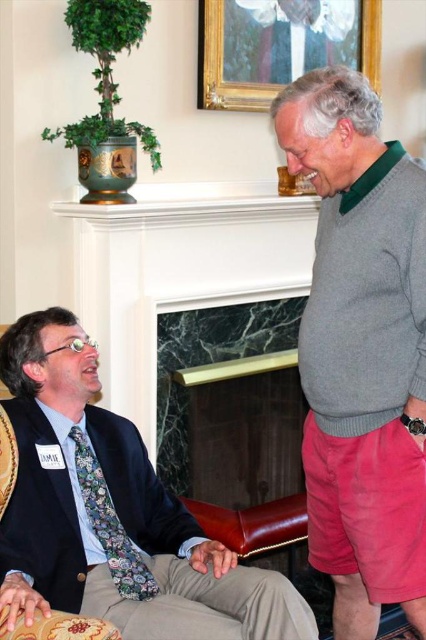
Between knit gray sweater at right and floral tie at left, which one appears on the left side from the viewer's perspective?

floral tie at left

Is knit gray sweater at right further to the viewer compared to floral tie at left?

Yes, knit gray sweater at right is behind floral tie at left.

Is point (419, 296) closer to viewer compared to point (242, 586)?

Yes, point (419, 296) is closer to viewer.

At what (x,y) coordinates should I click in order to perform the action: click on knit gray sweater at right. Please return your answer as a coordinate pair (x, y). This screenshot has height=640, width=426. Looking at the image, I should click on (362, 349).

Is knit gray sweater at right positioned before gold/gilded picture frame at upper center?

Yes, it is.

Locate an element on the screen. The image size is (426, 640). knit gray sweater at right is located at coordinates (362, 349).

You are a GUI agent. You are given a task and a screenshot of the screen. Output one action in this format:
    pyautogui.click(x=<x>, y=<y>)
    Task: Click on the knit gray sweater at right
    The image size is (426, 640).
    Given the screenshot: What is the action you would take?
    pyautogui.click(x=362, y=349)

Can you confirm if floral tie at left is thinner than gold/gilded picture frame at upper center?

No, floral tie at left is not thinner than gold/gilded picture frame at upper center.

Is floral tie at left bigger than gold/gilded picture frame at upper center?

Correct, floral tie at left is larger in size than gold/gilded picture frame at upper center.

This screenshot has height=640, width=426. Identify the location of floral tie at left. (112, 513).